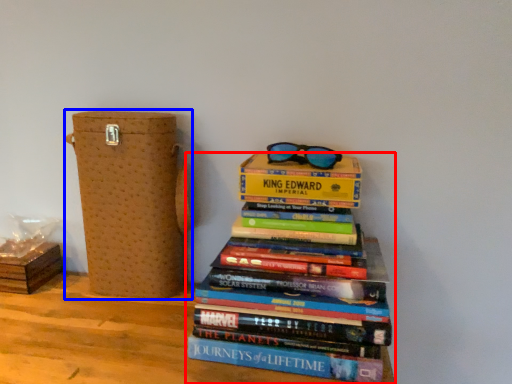
Question: Which of the following is the farthest to the observer, book (highlighted by a red box) or cardboard box (highlighted by a blue box)?

Choices:
 (A) book
 (B) cardboard box

Answer: (B)